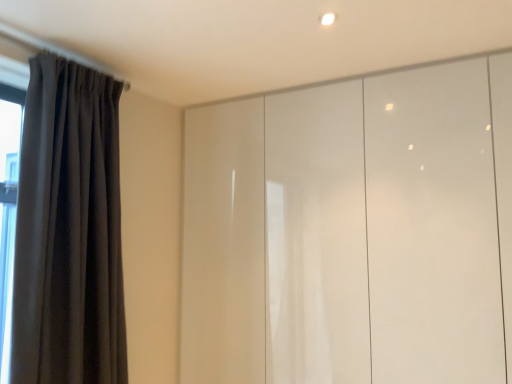
Question: Is glossy white cupboard at center facing towards dark grey velvet curtain at left?

Choices:
 (A) yes
 (B) no

Answer: (A)

Question: Is there a large distance between glossy white cupboard at center and dark grey velvet curtain at left?

Choices:
 (A) yes
 (B) no

Answer: (B)

Question: Is glossy white cupboard at center in front of dark grey velvet curtain at left?

Choices:
 (A) yes
 (B) no

Answer: (B)

Question: Is glossy white cupboard at center wider than dark grey velvet curtain at left?

Choices:
 (A) yes
 (B) no

Answer: (A)

Question: Is glossy white cupboard at center to the left of dark grey velvet curtain at left from the viewer's perspective?

Choices:
 (A) yes
 (B) no

Answer: (B)

Question: From the image's perspective, does glossy white cupboard at center appear lower than dark grey velvet curtain at left?

Choices:
 (A) yes
 (B) no

Answer: (A)

Question: From a real-world perspective, does dark grey velvet curtain at left sit lower than glossy white cupboard at center?

Choices:
 (A) yes
 (B) no

Answer: (B)

Question: Is dark grey velvet curtain at left not near glossy white cupboard at center?

Choices:
 (A) yes
 (B) no

Answer: (B)

Question: Does dark grey velvet curtain at left contain glossy white cupboard at center?

Choices:
 (A) no
 (B) yes

Answer: (A)

Question: Is the depth of dark grey velvet curtain at left greater than that of glossy white cupboard at center?

Choices:
 (A) no
 (B) yes

Answer: (A)

Question: From the image's perspective, is dark grey velvet curtain at left below glossy white cupboard at center?

Choices:
 (A) yes
 (B) no

Answer: (B)

Question: Can you confirm if dark grey velvet curtain at left is positioned to the left of glossy white cupboard at center?

Choices:
 (A) yes
 (B) no

Answer: (A)

Question: In the image, is dark grey velvet curtain at left positioned in front of or behind glossy white cupboard at center?

Choices:
 (A) front
 (B) behind

Answer: (A)